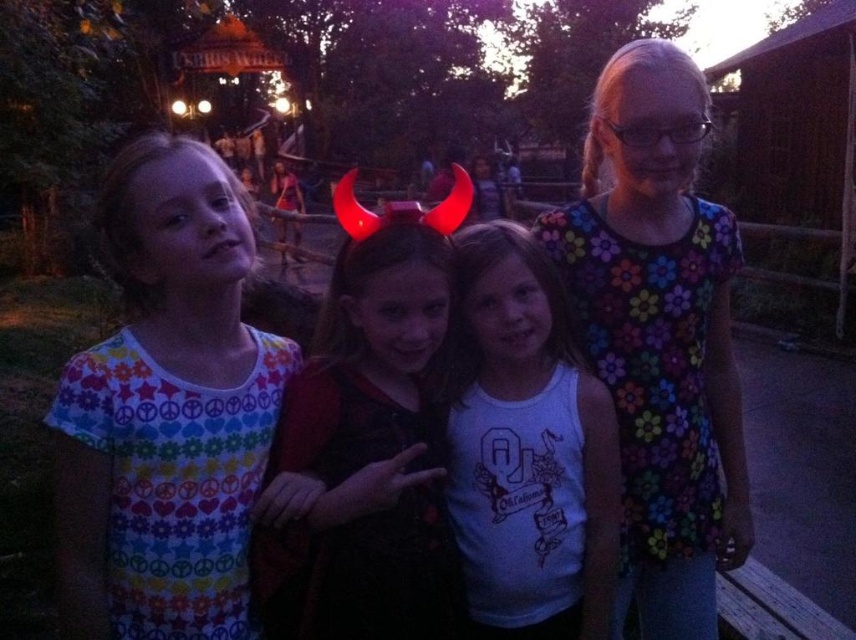
Question: Does multicolored fabric dress at left have a smaller size compared to black velvet horns at center?

Choices:
 (A) yes
 (B) no

Answer: (B)

Question: Does floral-patterned shirt at right appear under white cotton tank top at center?

Choices:
 (A) yes
 (B) no

Answer: (B)

Question: Which is farther from the white cotton tank top at center?

Choices:
 (A) multicolored fabric dress at left
 (B) floral-patterned shirt at right

Answer: (A)

Question: Based on their relative distances, which object is nearer to the black velvet horns at center?

Choices:
 (A) multicolored fabric dress at left
 (B) floral-patterned shirt at right

Answer: (A)

Question: Estimate the real-world distances between objects in this image. Which object is closer to the white cotton tank top at center?

Choices:
 (A) black velvet horns at center
 (B) multicolored fabric dress at left

Answer: (A)

Question: Does black velvet horns at center appear under white cotton tank top at center?

Choices:
 (A) no
 (B) yes

Answer: (A)